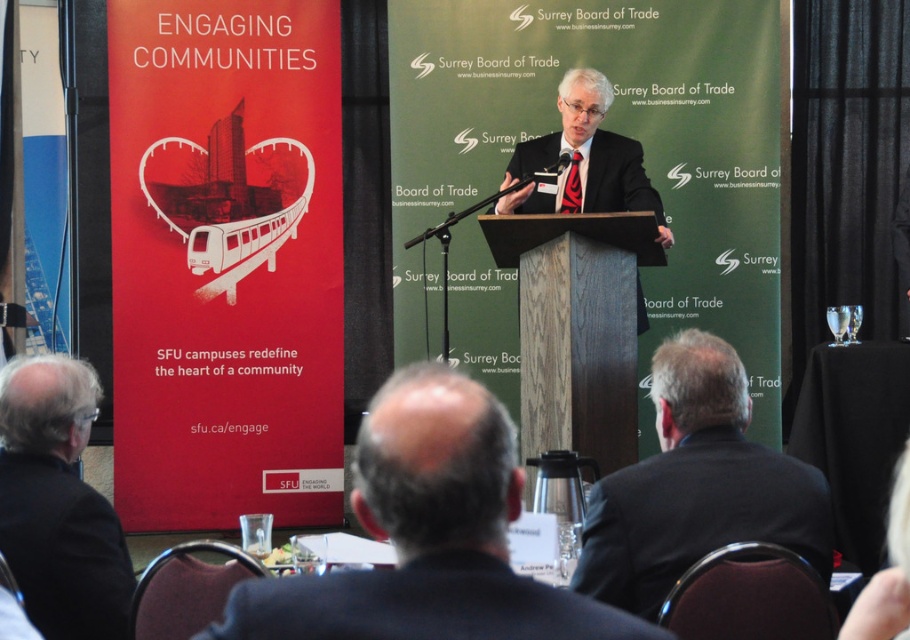
Between point (389, 460) and point (334, 634), which one is positioned in front?

Point (334, 634)

Is dark suit at center to the right of dark blue fabric business suit at center from the viewer's perspective?

In fact, dark suit at center is to the left of dark blue fabric business suit at center.

Describe the element at coordinates (430, 536) in the screenshot. I see `dark suit at center` at that location.

At what (x,y) coordinates should I click in order to perform the action: click on dark suit at center. Please return your answer as a coordinate pair (x, y). The image size is (910, 640). Looking at the image, I should click on (430, 536).

Does point (59, 502) lie in front of point (541, 160)?

Yes, it is.

Can you confirm if black suit at left is positioned below matte black suit at center?

Yes, black suit at left is below matte black suit at center.

What do you see at coordinates (58, 502) in the screenshot? The image size is (910, 640). I see `black suit at left` at bounding box center [58, 502].

Locate an element on the screen. black suit at left is located at coordinates (58, 502).

Can you confirm if dark suit at center is positioned below black suit at left?

Actually, dark suit at center is above black suit at left.

Can you confirm if dark suit at center is bigger than black suit at left?

Incorrect, dark suit at center is not larger than black suit at left.

Does point (477, 484) lie behind point (59, 515)?

That is False.

Locate an element on the screen. dark suit at center is located at coordinates (430, 536).